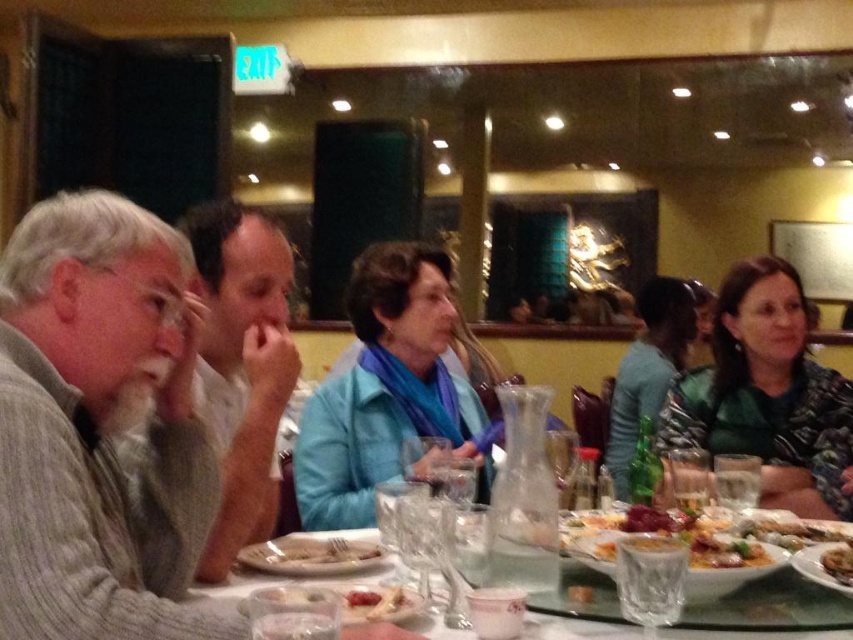
You are a waiter at the restaurant and need to place a new dessert plate between the gray knitted sweater at left and the golden crispy pastry at center. Can you fit it there?

The gray knitted sweater at left has a larger size compared to golden crispy pastry at center, so there might not be enough space between them to place the dessert plate.

You are sitting at the dining table in the restaurant and want to reach both the point at coordinates point (236, 328) and the point at coordinates point (828, 557). Which point is closer to you?

Point (828, 557) is closer to you because it is in front of point (236, 328).